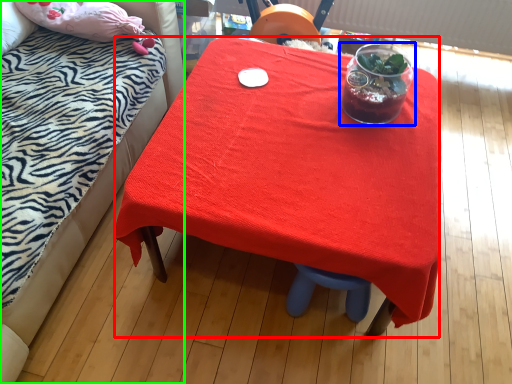
Question: Which object is the farthest from desk (highlighted by a red box)? Choose among these: tableware (highlighted by a blue box) or bed (highlighted by a green box).

Choices:
 (A) tableware
 (B) bed

Answer: (B)